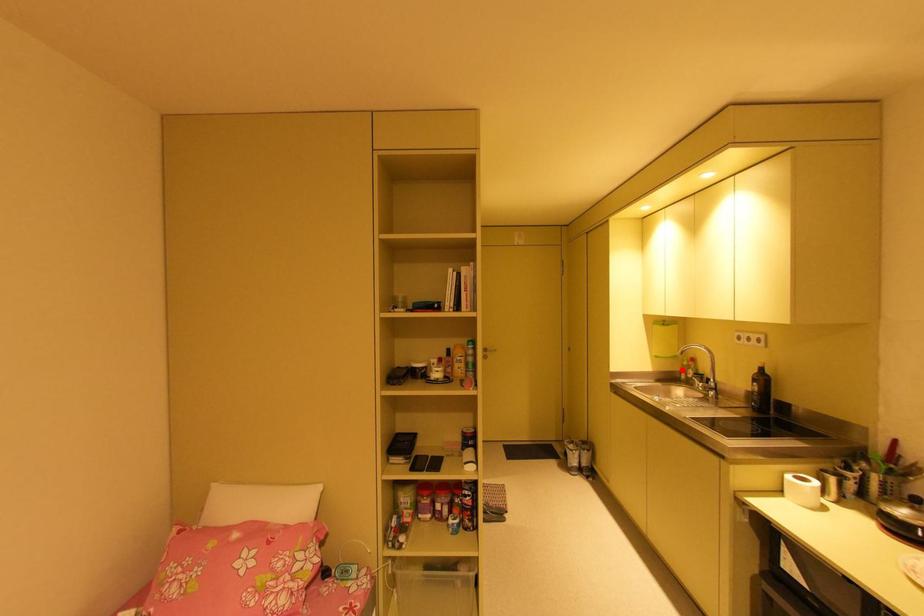
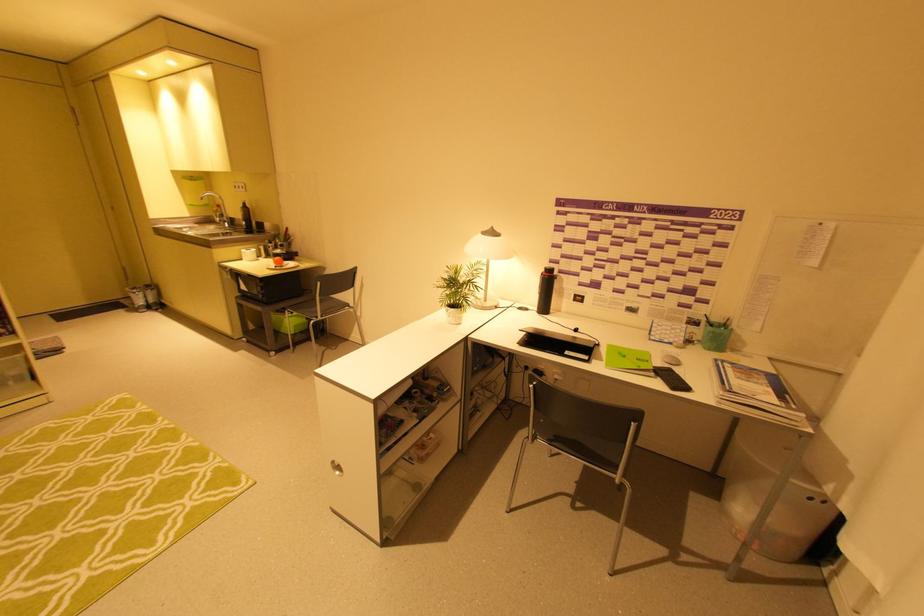
Question: I am providing you with two images of the same scene from different viewpoints. Given a red point in image1, look at the same physical point in image2. Is it:

Choices:
 (A) Closer to the viewpoint
 (B) Farther from the viewpoint

Answer: (A)